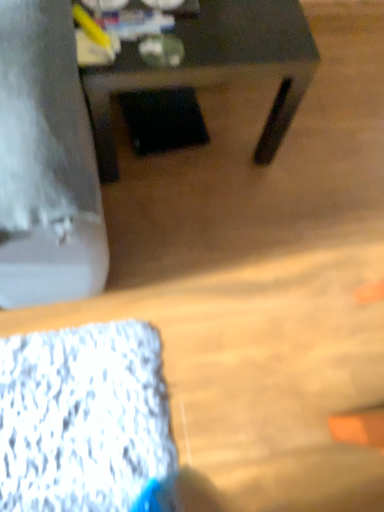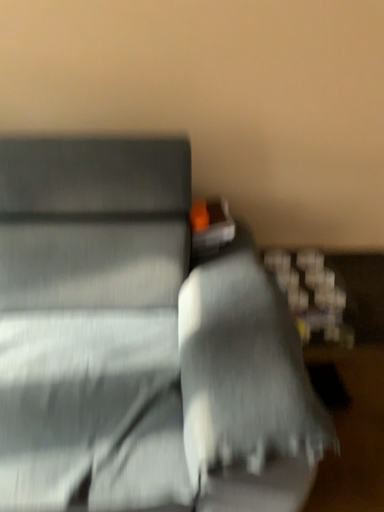
Question: Which way did the camera rotate in the video?

Choices:
 (A) rotated downward
 (B) rotated upward

Answer: (B)